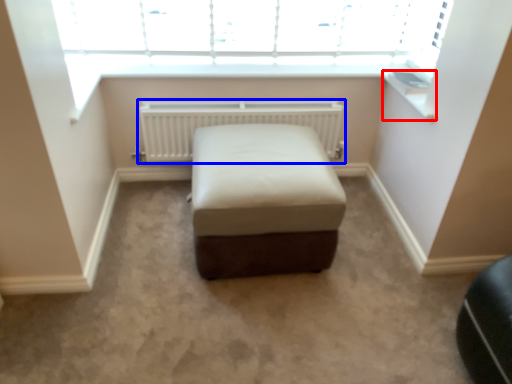
Question: Which object is closer to the camera taking this photo, window sill (highlighted by a red box) or radiator (highlighted by a blue box)?

Choices:
 (A) window sill
 (B) radiator

Answer: (A)